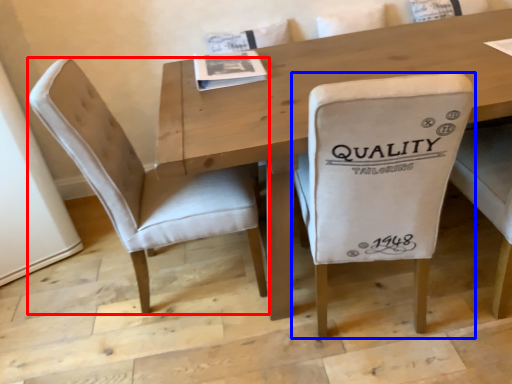
Question: Which of the following is the closest to the observer, chair (highlighted by a red box) or chair (highlighted by a blue box)?

Choices:
 (A) chair
 (B) chair

Answer: (B)